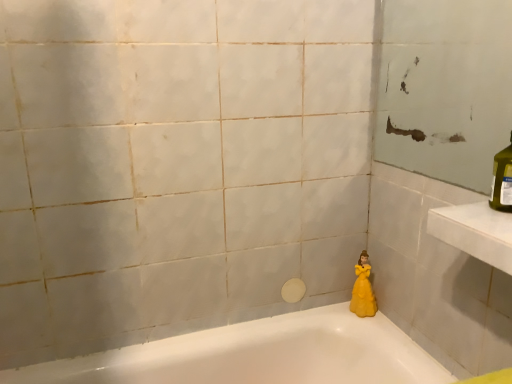
Find the location of a particular element. free location in front of yellow matte doll at lower right is located at coordinates (384, 331).